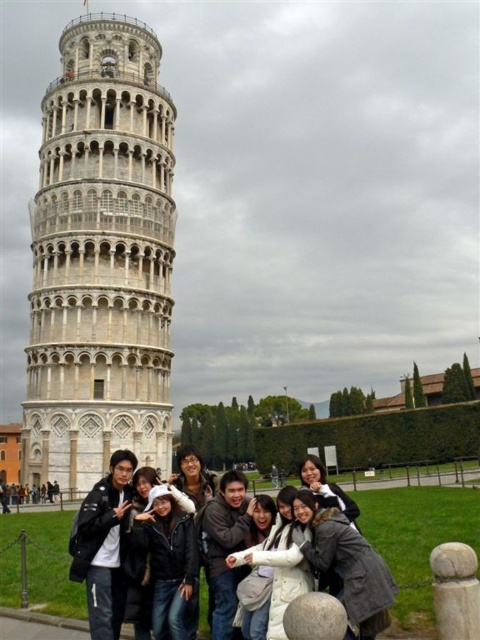
Does gray wool coat at center have a smaller size compared to white fur-trimmed hat at center?

Indeed, gray wool coat at center has a smaller size compared to white fur-trimmed hat at center.

This screenshot has width=480, height=640. Identify the location of gray wool coat at center. (x=345, y=564).

Find the location of a particular element. This screenshot has width=480, height=640. gray wool coat at center is located at coordinates (345, 564).

What do you see at coordinates (345, 564) in the screenshot? I see `gray wool coat at center` at bounding box center [345, 564].

Which is behind, point (374, 614) or point (71, 552)?

The point (71, 552) is behind.

Where is `gray wool coat at center`? The width and height of the screenshot is (480, 640). gray wool coat at center is located at coordinates (345, 564).

Who is taller, black leather jacket at center or white fleece jacket at center?

black leather jacket at center is taller.

Is black leather jacket at center thinner than white fleece jacket at center?

No, black leather jacket at center is not thinner than white fleece jacket at center.

Who is more distant from viewer, (106,609) or (259,600)?

Point (106,609)

Image resolution: width=480 pixels, height=640 pixels. In order to click on black leather jacket at center in this screenshot , I will do `click(104, 545)`.